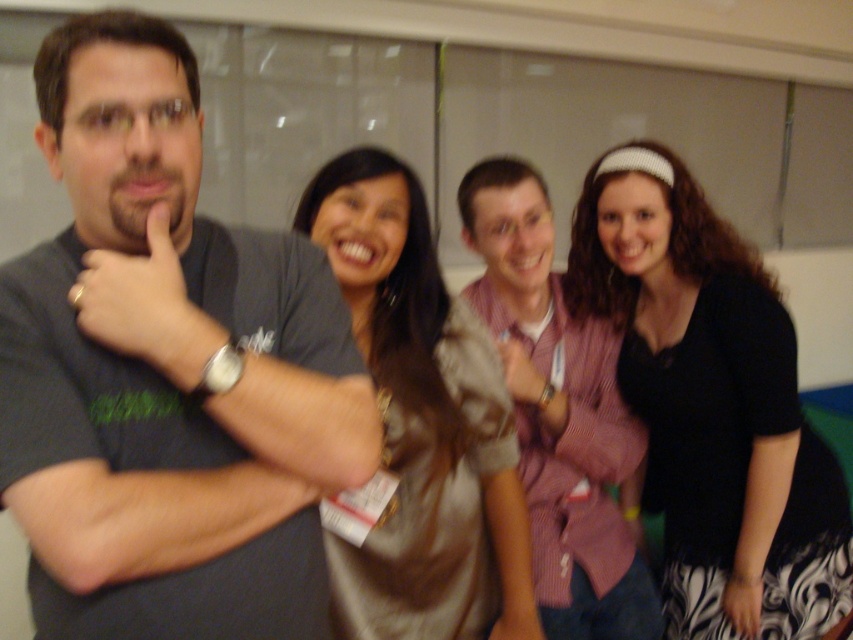
Can you confirm if gray matte t-shirt at center is shorter than pink striped shirt at center?

Correct, gray matte t-shirt at center is not as tall as pink striped shirt at center.

Does gray matte t-shirt at center have a greater width compared to pink striped shirt at center?

No, gray matte t-shirt at center is not wider than pink striped shirt at center.

Who is more forward, [222,636] or [601,506]?

Point [222,636] is more forward.

Find the location of a particular element. gray matte t-shirt at center is located at coordinates (164, 360).

Is silky beige blouse at center positioned at the back of pink striped shirt at center?

No.

Identify the location of silky beige blouse at center. The height and width of the screenshot is (640, 853). (422, 420).

Is point (410, 388) more distant than point (730, 612)?

No, it is not.

Does silky beige blouse at center have a lesser width compared to black fabric at right?

No.

This screenshot has width=853, height=640. Find the location of `silky beige blouse at center`. silky beige blouse at center is located at coordinates (422, 420).

Locate an element on the screen. silky beige blouse at center is located at coordinates (422, 420).